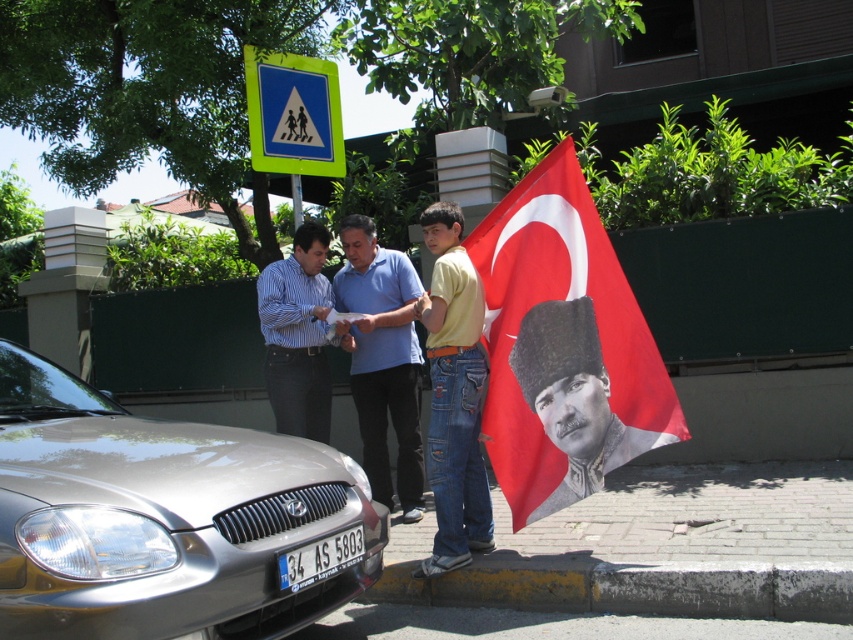
Does blue shirt at center have a lesser height compared to green plastic pedestrian crossing sign at upper center?

In fact, blue shirt at center may be taller than green plastic pedestrian crossing sign at upper center.

Between point (409, 474) and point (306, 148), which one is positioned behind?

The point (306, 148) is more distant.

Find the location of a particular element. blue shirt at center is located at coordinates (381, 358).

The height and width of the screenshot is (640, 853). What do you see at coordinates (167, 518) in the screenshot?
I see `satin silver car at lower left` at bounding box center [167, 518].

Who is more forward, (113, 602) or (288, 413)?

Point (113, 602)

Find the location of a particular element. This screenshot has height=640, width=853. satin silver car at lower left is located at coordinates (167, 518).

Is satin silver car at lower left below black textured portrait at center?

Yes.

Which of these two, satin silver car at lower left or black textured portrait at center, stands taller?

Standing taller between the two is black textured portrait at center.

Locate an element on the screen. The width and height of the screenshot is (853, 640). satin silver car at lower left is located at coordinates (167, 518).

Identify the location of satin silver car at lower left. (167, 518).